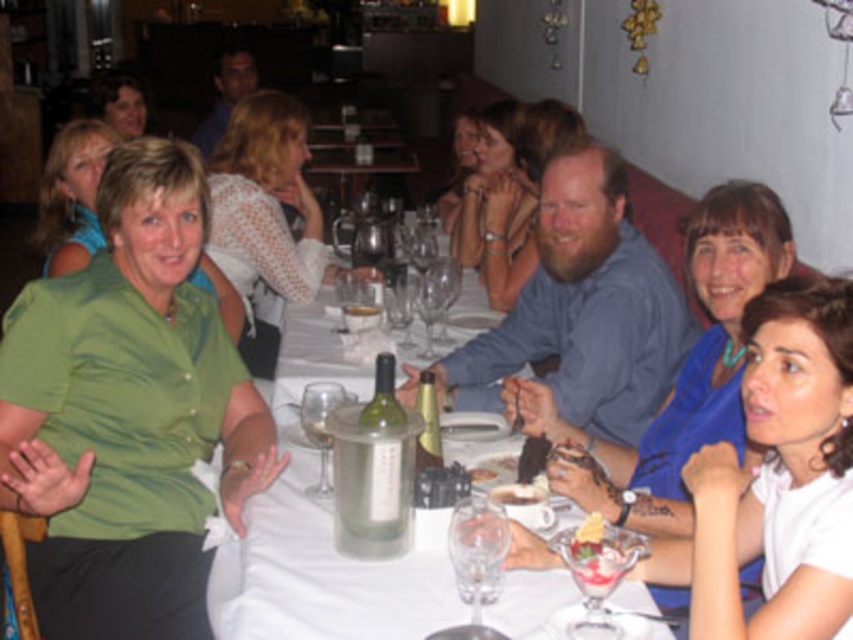
Who is taller, clear glass wine glass at center or matte black hair at upper left?

matte black hair at upper left is taller.

Looking at this image, can you confirm if clear glass wine glass at center is positioned above matte black hair at upper left?

Incorrect, clear glass wine glass at center is not positioned above matte black hair at upper left.

Between point (300, 417) and point (115, 86), which one is positioned in front?

Point (300, 417) is more forward.

Where is `clear glass wine glass at center`? The width and height of the screenshot is (853, 640). clear glass wine glass at center is located at coordinates (318, 428).

Who is more distant from viewer, (585, 616) or (367, 310)?

The point (367, 310) is behind.

Who is lower down, clear glass wine glass at lower center or translucent glass wine at center?

Positioned lower is clear glass wine glass at lower center.

You are a GUI agent. You are given a task and a screenshot of the screen. Output one action in this format:
    pyautogui.click(x=<x>, y=<y>)
    Task: Click on the clear glass wine glass at lower center
    
    Given the screenshot: What is the action you would take?
    pyautogui.click(x=596, y=570)

Is green satin blouse at upper left smaller than blue shirt at center?

Incorrect, green satin blouse at upper left is not smaller in size than blue shirt at center.

Which is above, green satin blouse at upper left or blue shirt at center?

blue shirt at center is above.

Who is more distant from viewer, (39,372) or (624,252)?

Positioned behind is point (624,252).

Identify the location of green satin blouse at upper left. (132, 410).